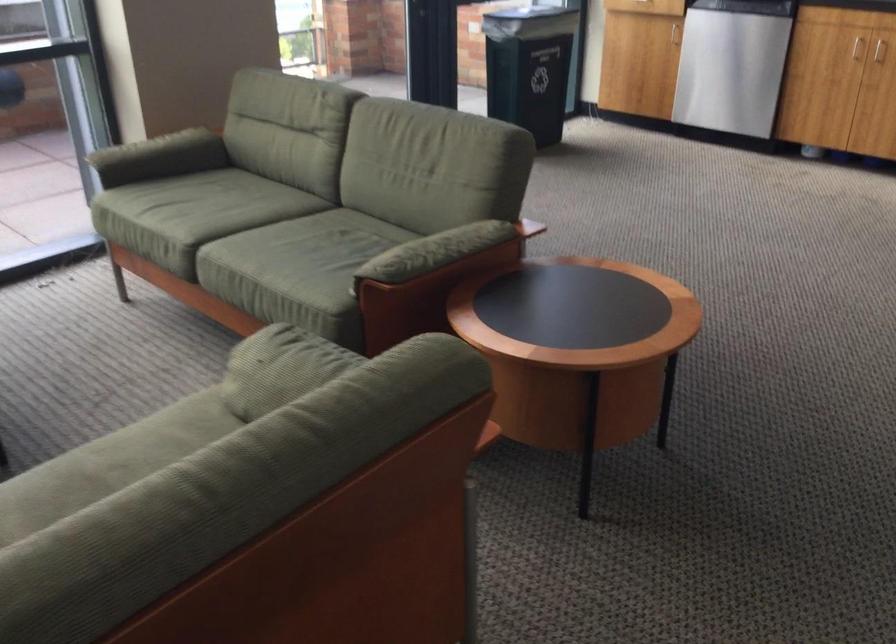
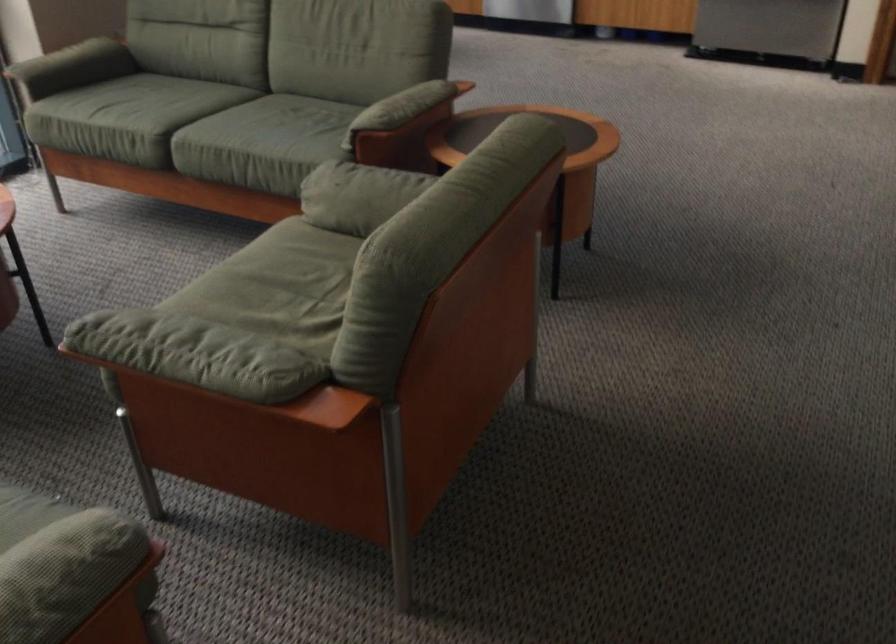
In the second image, find the point that corresponds to (152,205) in the first image.

(97, 108)